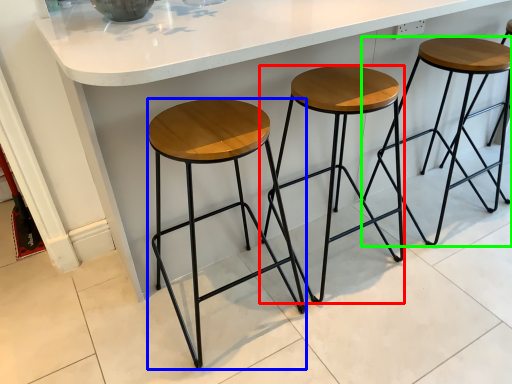
Question: Which object is the farthest from stool (highlighted by a red box)? Choose among these: stool (highlighted by a blue box) or stool (highlighted by a green box).

Choices:
 (A) stool
 (B) stool

Answer: (B)